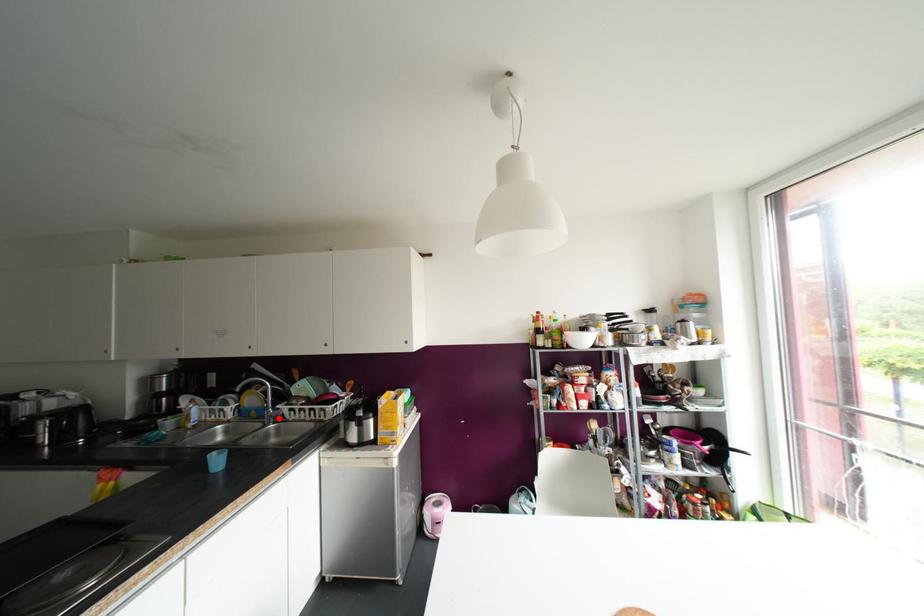
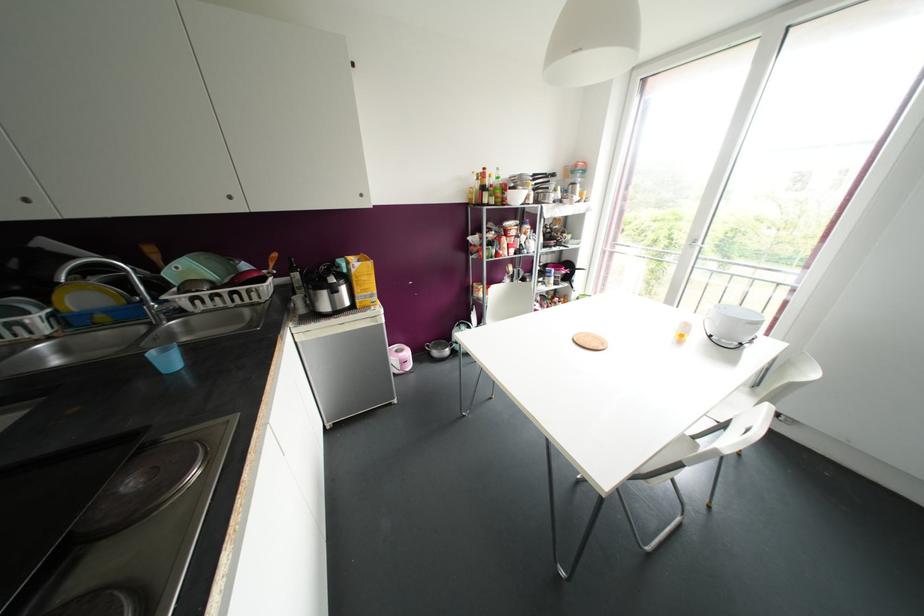
Locate, in the second image, the point that corresponds to the highlighted location in the first image.

(178, 312)